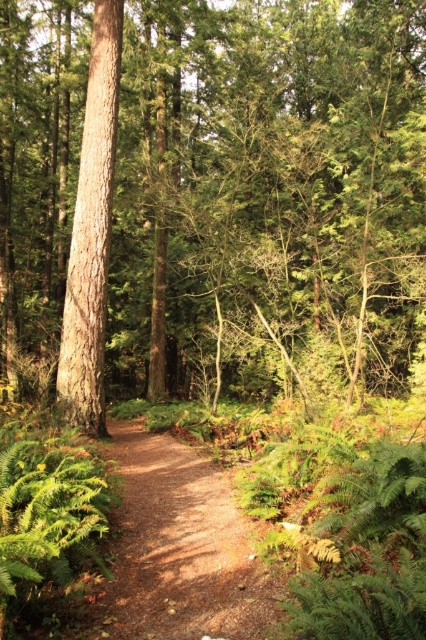
Question: Which object is the farthest from the brown rough tree at center?

Choices:
 (A) smooth brown tree trunk at center
 (B) brown dirt path at center

Answer: (B)

Question: Among these objects, which one is farthest from the camera?

Choices:
 (A) brown dirt path at center
 (B) smooth brown tree trunk at center

Answer: (B)

Question: Is brown dirt path at center thinner than smooth brown tree trunk at center?

Choices:
 (A) yes
 (B) no

Answer: (B)

Question: Which of the following is the closest to the observer?

Choices:
 (A) brown rough tree at center
 (B) smooth brown tree trunk at center

Answer: (A)

Question: Can you confirm if brown rough tree at center is positioned below brown dirt path at center?

Choices:
 (A) yes
 (B) no

Answer: (B)

Question: In this image, where is brown dirt path at center located relative to smooth brown tree trunk at center?

Choices:
 (A) left
 (B) right

Answer: (B)